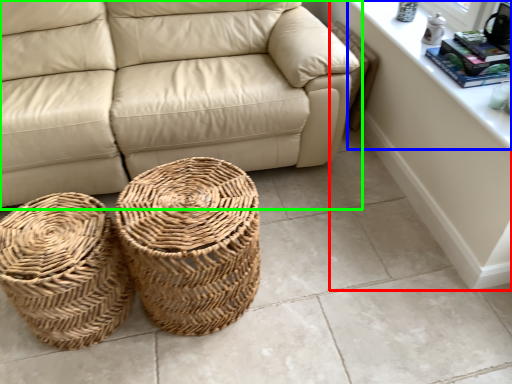
Question: Which is nearer to the dresser (highlighted by a red box)? window sill (highlighted by a blue box) or studio couch (highlighted by a green box).

Choices:
 (A) window sill
 (B) studio couch

Answer: (A)